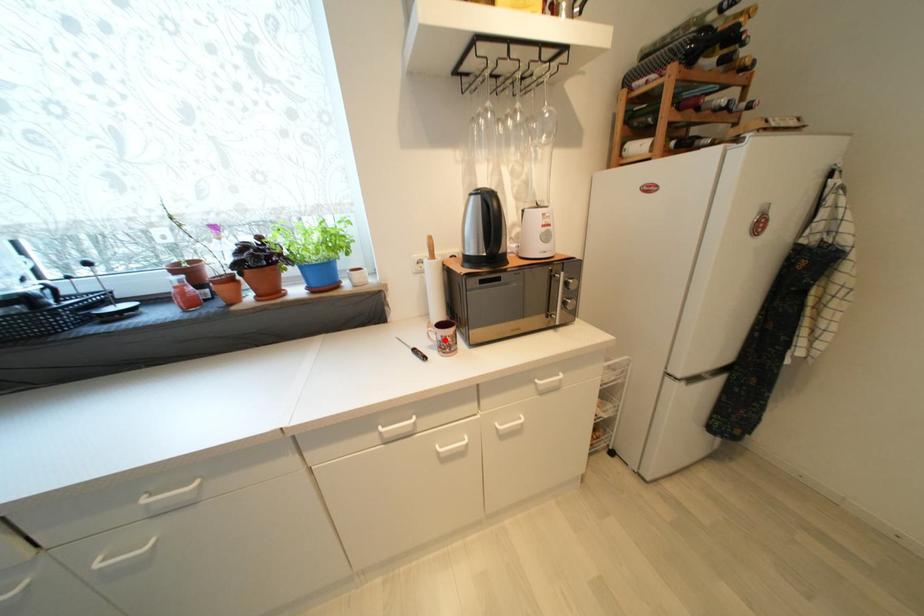
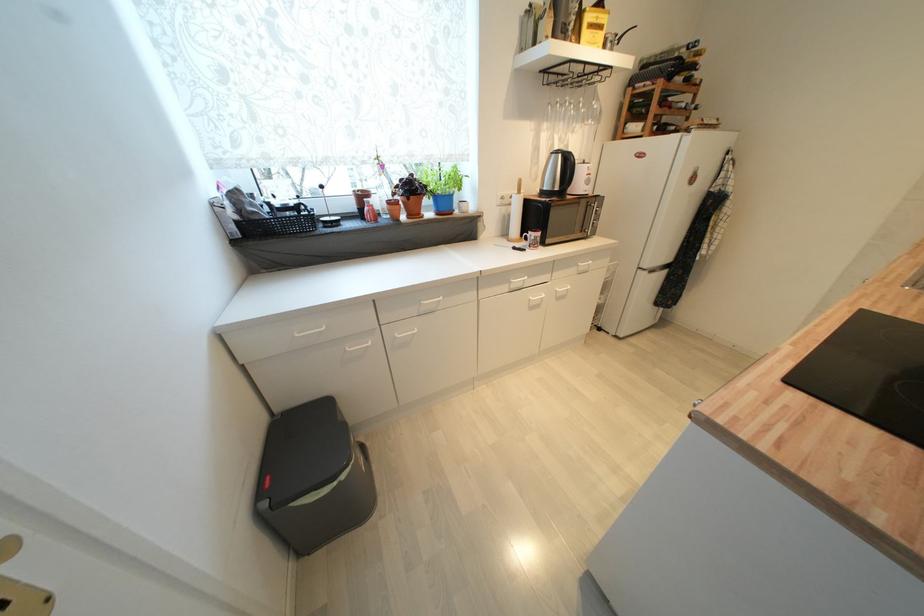
Find the pixel in the second image that matches the highlighted location in the first image.

(538, 240)